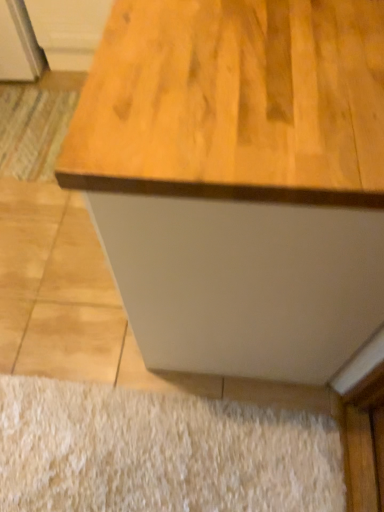
I want to click on vacant point above white shaggy rug at lower center, arranged as the 1th doormat when ordered from the bottom (from a real-world perspective), so click(x=154, y=446).